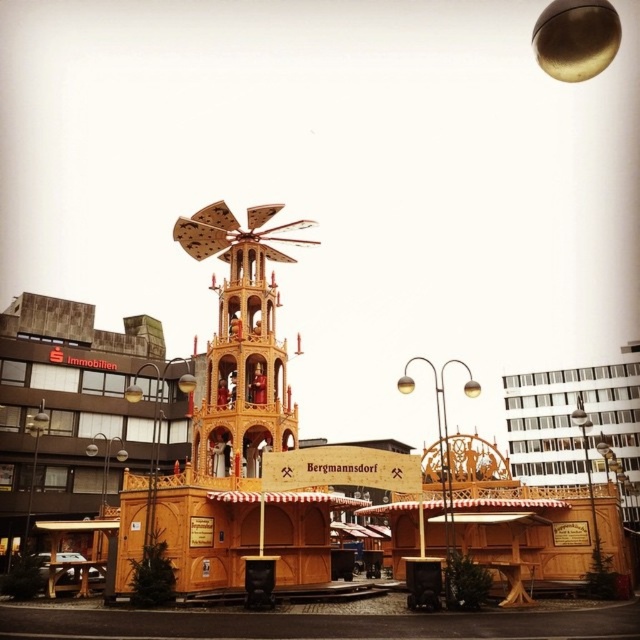
Question: Which point is farther to the camera?

Choices:
 (A) (272, 282)
 (B) (100, 467)

Answer: (B)

Question: Can you confirm if wooden christmas pyramid at center is bigger than wooden windmill at center?

Choices:
 (A) yes
 (B) no

Answer: (A)

Question: Which point appears closest to the camera in this image?

Choices:
 (A) (252, 444)
 (B) (273, 360)

Answer: (A)

Question: Which point is farther to the camera?

Choices:
 (A) wooden windmill at center
 (B) wooden christmas pyramid at center

Answer: (A)

Question: Is wooden christmas pyramid at center bigger than wooden windmill at center?

Choices:
 (A) yes
 (B) no

Answer: (A)

Question: Does wooden christmas pyramid at center have a lesser width compared to wooden windmill at center?

Choices:
 (A) yes
 (B) no

Answer: (B)